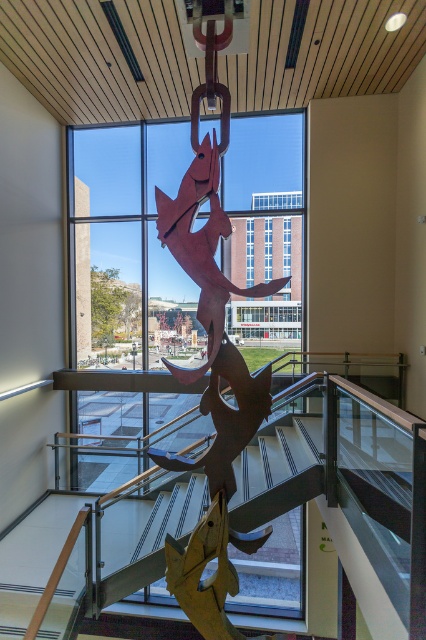
Question: Does wooden fish at center lie behind metallic staircase at center?

Choices:
 (A) no
 (B) yes

Answer: (B)

Question: Which of the following is the farthest from the observer?

Choices:
 (A) metallic staircase at center
 (B) wooden fish at center

Answer: (B)

Question: Does wooden fish at center lie behind metallic staircase at center?

Choices:
 (A) no
 (B) yes

Answer: (B)

Question: Among these points, which one is farthest from the camera?

Choices:
 (A) (173, 522)
 (B) (250, 122)

Answer: (B)

Question: Which object appears closest to the camera in this image?

Choices:
 (A) wooden fish at center
 (B) metallic staircase at center

Answer: (B)

Question: Is wooden fish at center positioned at the back of metallic staircase at center?

Choices:
 (A) no
 (B) yes

Answer: (B)